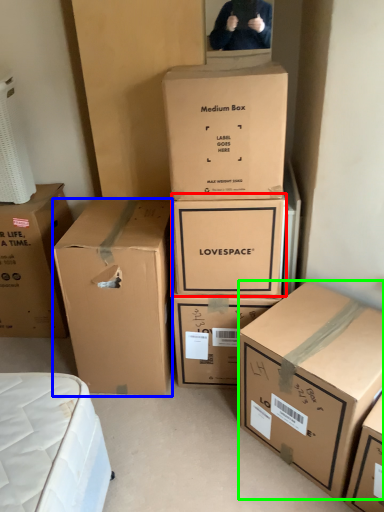
Question: Based on their relative distances, which object is nearer to box (highlighted by a red box)? Choose from box (highlighted by a blue box) and box (highlighted by a green box).

Choices:
 (A) box
 (B) box

Answer: (A)